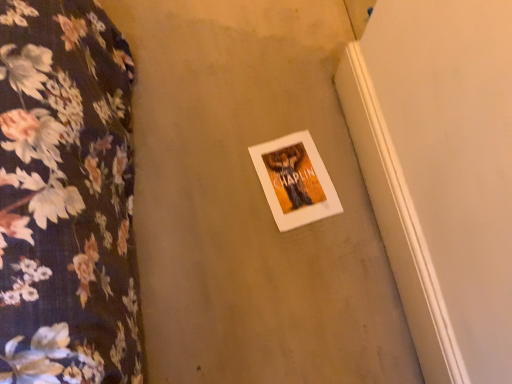
This screenshot has width=512, height=384. I want to click on vacant space behind white paper at center, so click(x=282, y=109).